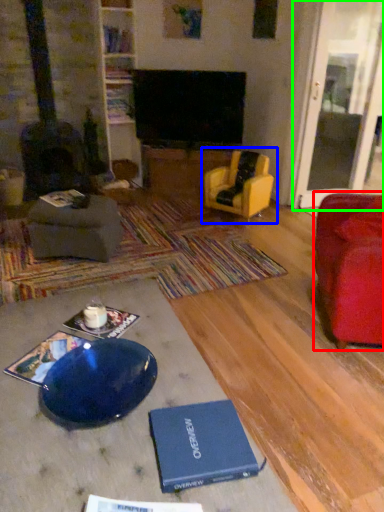
Question: Which is farther away from chair (highlighted by a red box)? chair (highlighted by a blue box) or glass door (highlighted by a green box)?

Choices:
 (A) chair
 (B) glass door

Answer: (B)